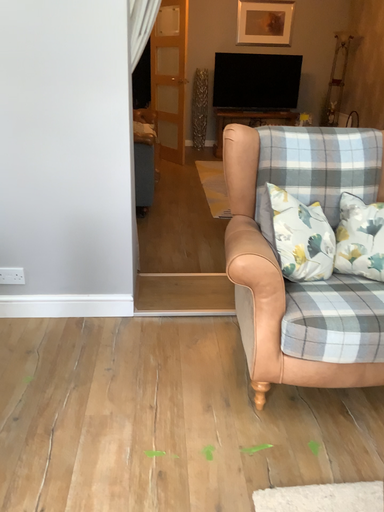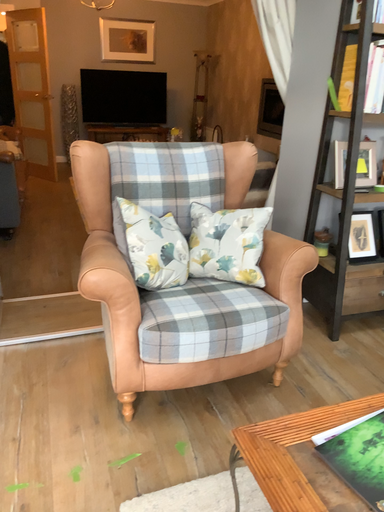
Question: How did the camera likely rotate when shooting the video?

Choices:
 (A) rotated left
 (B) rotated right

Answer: (B)